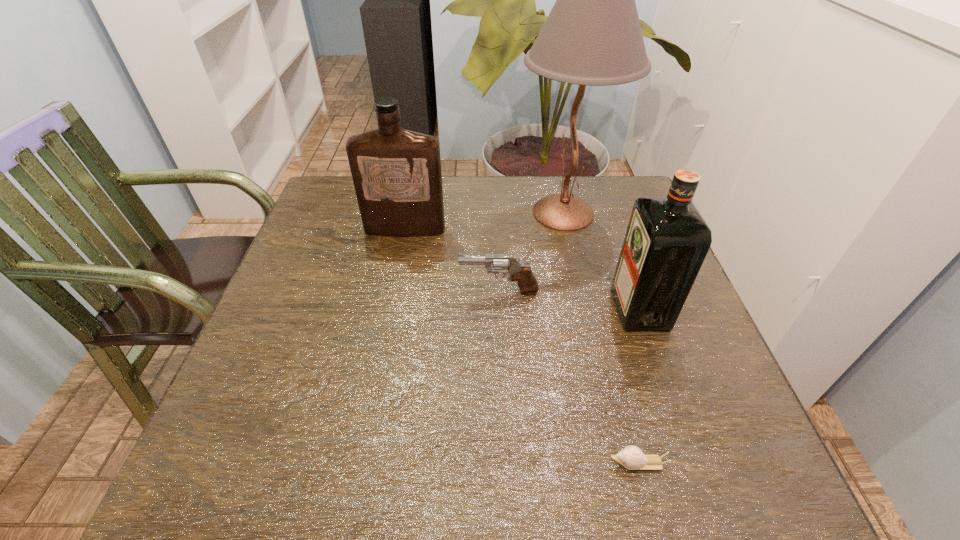
You are a GUI agent. You are given a task and a screenshot of the screen. Output one action in this format:
    pyautogui.click(x=<x>, y=<y>)
    Task: Click on the free point between the escargot and the leftmost object
    The width and height of the screenshot is (960, 540).
    Given the screenshot: What is the action you would take?
    pyautogui.click(x=522, y=346)

Find the location of `vacant region between the table lamp and the leftmost object`. vacant region between the table lamp and the leftmost object is located at coordinates (484, 221).

You are a GUI agent. You are given a task and a screenshot of the screen. Output one action in this format:
    pyautogui.click(x=<x>, y=<y>)
    Task: Click on the empty location between the tallest object and the nearer liquor
    This screenshot has width=960, height=540.
    Given the screenshot: What is the action you would take?
    pyautogui.click(x=602, y=260)

This screenshot has height=540, width=960. I want to click on free spot between the farther liquor and the shortest object, so click(522, 346).

The image size is (960, 540). In order to click on free space between the nearest object and the right liquor in this screenshot , I will do `click(639, 386)`.

This screenshot has width=960, height=540. Find the location of `object that is the fourth closest one to the right liquor`. object that is the fourth closest one to the right liquor is located at coordinates (396, 173).

Locate which object is the closest to the right liquor. Please provide its 2D coordinates. Your answer should be formatted as a tuple, i.e. [(x, y)], where the tuple contains the x and y coordinates of a point satisfying the conditions above.

[(592, 36)]

Identify the location of vacant region that satisfies the following two spatial constraints: 1. on the front-facing side of the tallest object; 2. on the label side of the left liquor. (567, 230).

Identify the location of vacant space that satisfies the following two spatial constraints: 1. on the front-facing side of the table lamp; 2. on the label side of the leftmost object. (567, 230).